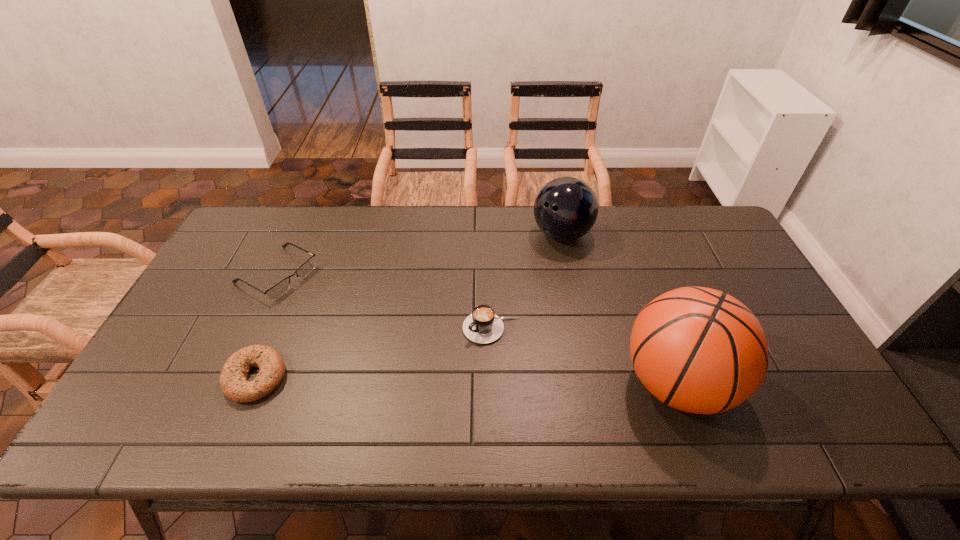
Find the location of a particular element. vacant space positioned 0.270m on the side of the second tallest object with the finger holes is located at coordinates (502, 302).

This screenshot has height=540, width=960. I want to click on free spot located with the handle on the side of the third object from right to left, so click(x=436, y=372).

You are a GUI agent. You are given a task and a screenshot of the screen. Output one action in this format:
    pyautogui.click(x=<x>, y=<y>)
    Task: Click on the blank area located 0.200m with the handle on the side of the third object from right to left
    
    Given the screenshot: What is the action you would take?
    pyautogui.click(x=415, y=390)

Locate an element on the screen. Image resolution: width=960 pixels, height=540 pixels. vacant space positioned 0.150m with the handle on the side of the third object from right to left is located at coordinates (430, 377).

Find the location of a particular element. The image size is (960, 540). free region located on the front-facing side of the spectacles is located at coordinates (347, 312).

This screenshot has height=540, width=960. What are the coordinates of `free region located on the front-facing side of the spectacles` in the screenshot? It's located at (383, 330).

At what (x,y) coordinates should I click in order to perform the action: click on free space located on the front-facing side of the spectacles. Please return your answer as a coordinate pair (x, y). This screenshot has height=540, width=960. Looking at the image, I should click on (389, 334).

Image resolution: width=960 pixels, height=540 pixels. I want to click on bowling ball positioned at the far edge, so click(566, 208).

In order to click on spectacles positioned at the far edge in this screenshot , I will do `click(279, 289)`.

Locate an element on the screen. The width and height of the screenshot is (960, 540). bagel that is at the near edge is located at coordinates (233, 377).